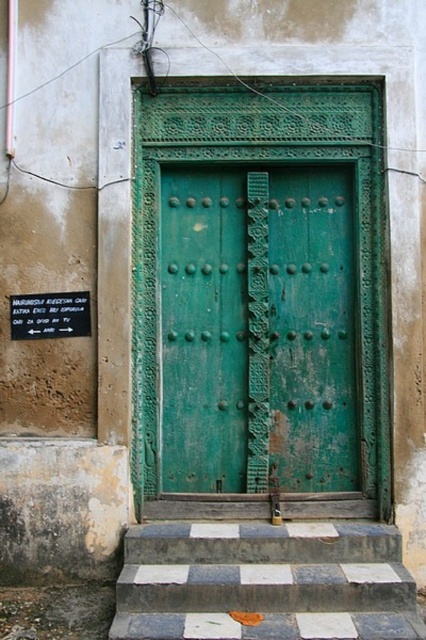
You are a delivery person trying to reach the door. You see the checkerboard tile stairs at center and the black plastic sign at lower left. Which object is closer to the ground?

The checkerboard tile stairs at center is located below the black plastic sign at lower left, so it is closer to the ground.